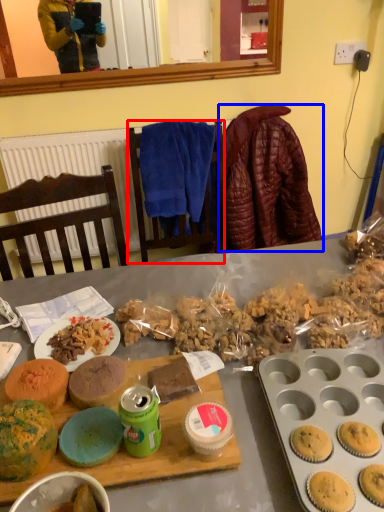
Question: Which point is closer to the camera, chair (highlighted by a red box) or blanket (highlighted by a blue box)?

Choices:
 (A) chair
 (B) blanket

Answer: (A)